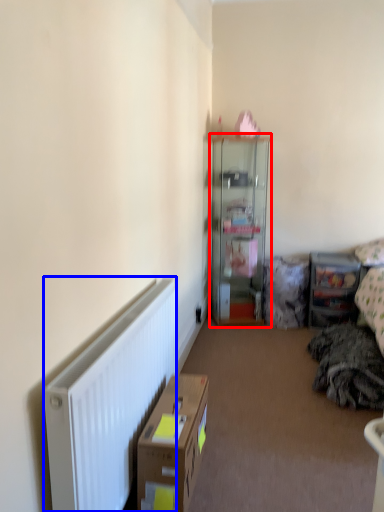
Question: Which point is closer to the camera, cabinetry (highlighted by a red box) or radiator (highlighted by a blue box)?

Choices:
 (A) cabinetry
 (B) radiator

Answer: (B)